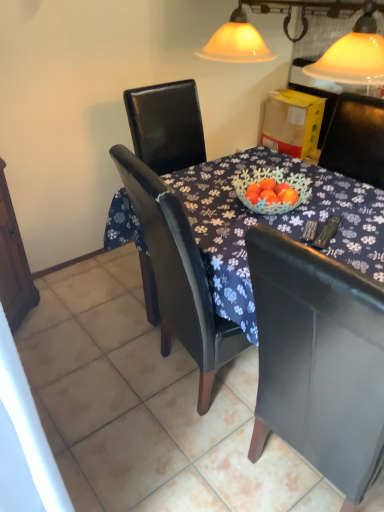
At what (x,y) coordinates should I click in order to perform the action: click on vacant space situated on the left part of dark wood table at center. Please return your answer as a coordinate pair (x, y). This screenshot has height=512, width=384. Looking at the image, I should click on (94, 373).